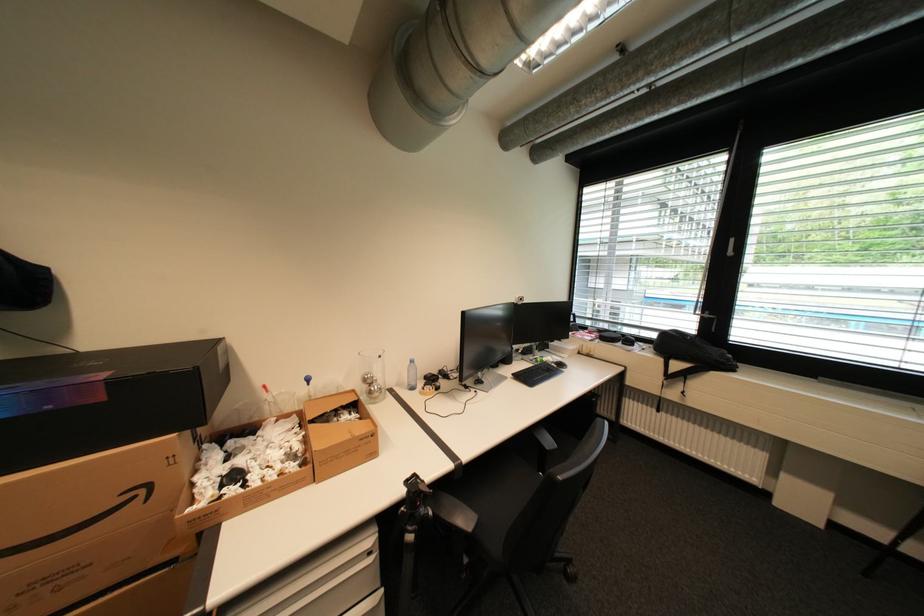
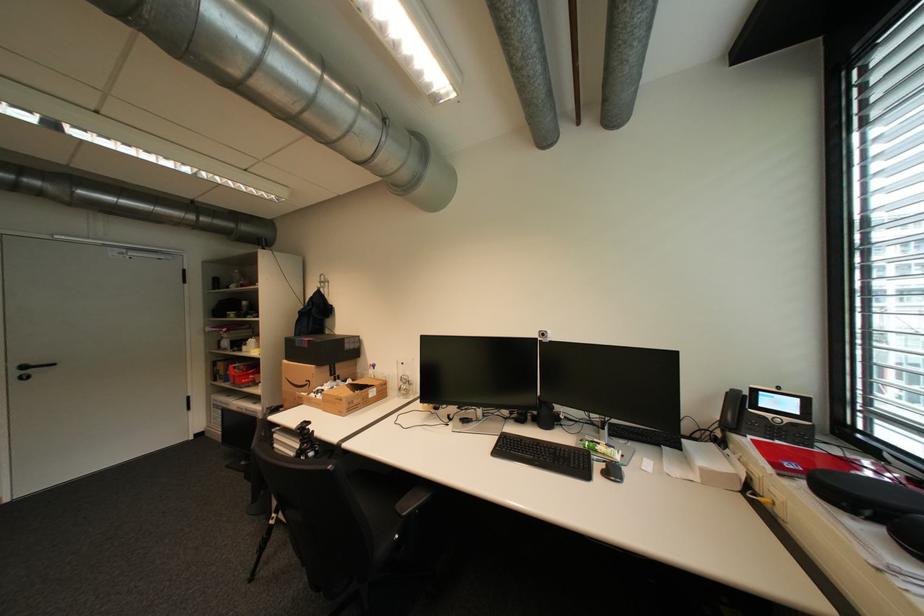
Question: I am providing you with two images of the same scene from different viewpoints. Please identify which objects are invisible in image2.

Choices:
 (A) black hanging bag
 (B) black chair armrest
 (C) small webcam
 (D) large cardboard box

Answer: (B)